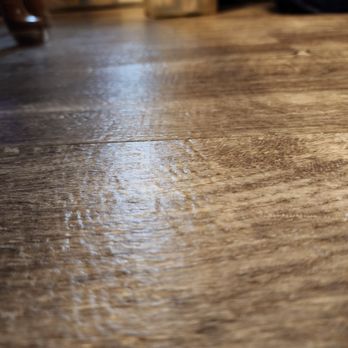
Locate an element on the screen. The height and width of the screenshot is (348, 348). ridges in floor is located at coordinates (81, 225), (67, 220), (75, 310), (90, 305), (109, 305), (195, 205), (171, 181), (188, 175), (107, 131).